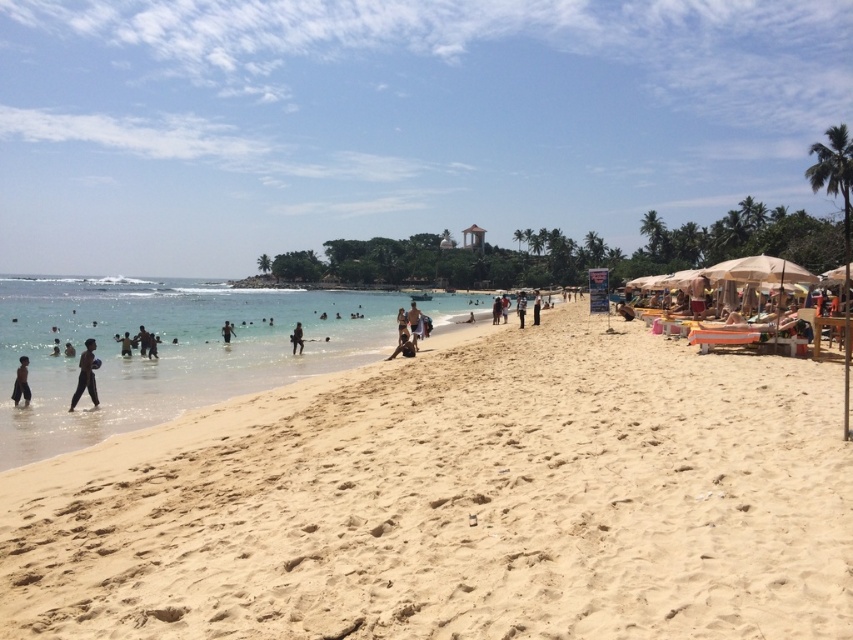
You are standing on the beach and want to hand a towel to the dark skin human at lower left. You have a whistle that can be heard up to 30 meters. Can you signal them using the whistle from where the white cotton shirt at center is located?

The dark skin human at lower left and white cotton shirt at center are 37.09 meters apart. Since the whistle can only be heard up to 30 meters, you cannot signal them using the whistle from where the white cotton shirt at center is located.

You are standing on the light beige sand at center and want to reach the dark blue fabric at center. If you walk directly towards it, how far will you have to walk in feet?

The distance between the light beige sand at center and the dark blue fabric at center is 40.79 feet, so you will have to walk 40.79 feet to reach it.